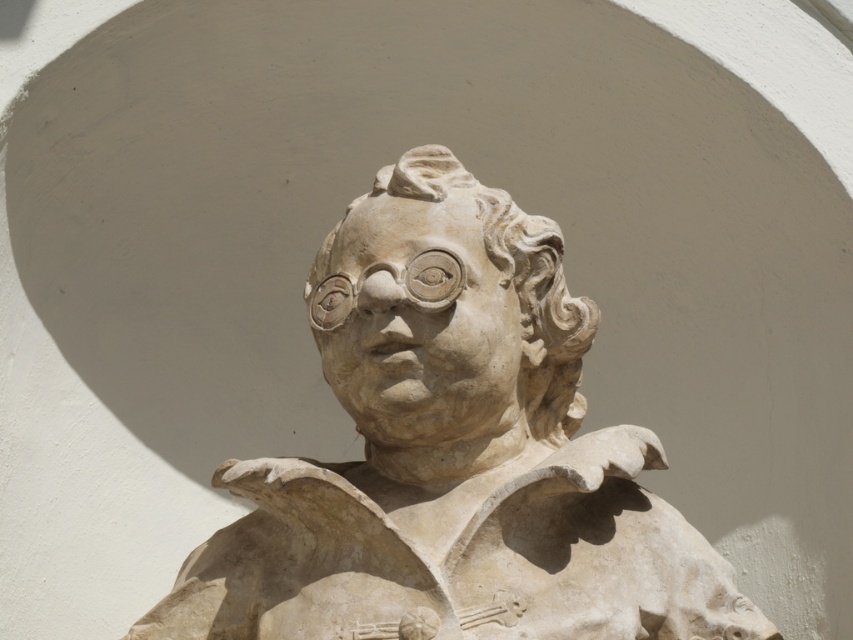
Question: Which object appears closest to the camera in this image?

Choices:
 (A) white stone head at center
 (B) stone sculpture at center

Answer: (B)

Question: Does stone sculpture at center appear on the right side of white stone head at center?

Choices:
 (A) no
 (B) yes

Answer: (B)

Question: Is stone sculpture at center positioned before white stone head at center?

Choices:
 (A) yes
 (B) no

Answer: (A)

Question: Among these points, which one is farthest from the camera?

Choices:
 (A) (366, 256)
 (B) (498, 256)

Answer: (B)

Question: Is stone sculpture at center further to camera compared to white stone head at center?

Choices:
 (A) yes
 (B) no

Answer: (B)